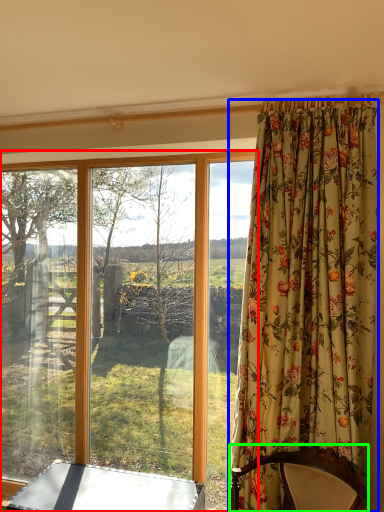
Question: Which is nearer to the window (highlighted by a red box)? curtain (highlighted by a blue box) or furniture (highlighted by a green box).

Choices:
 (A) curtain
 (B) furniture

Answer: (A)